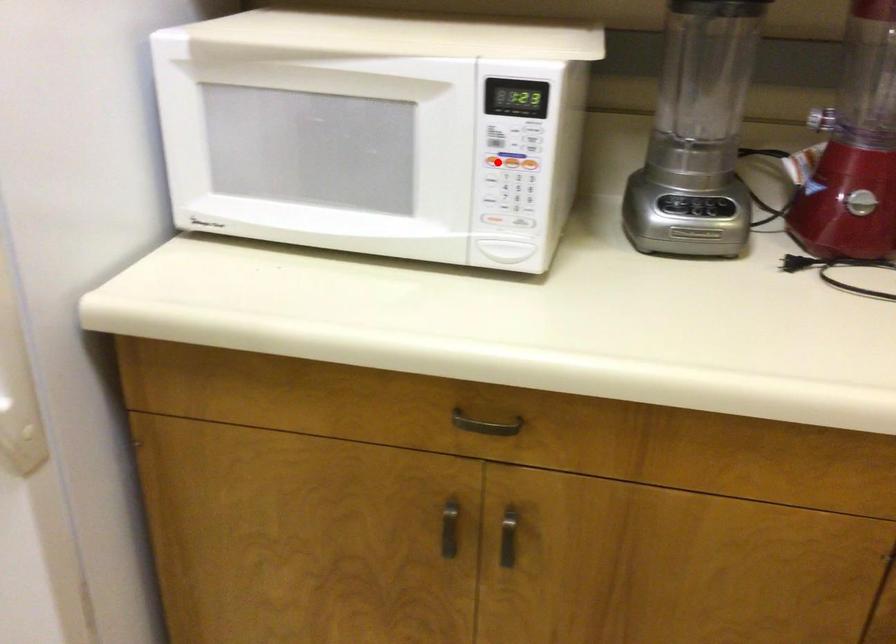
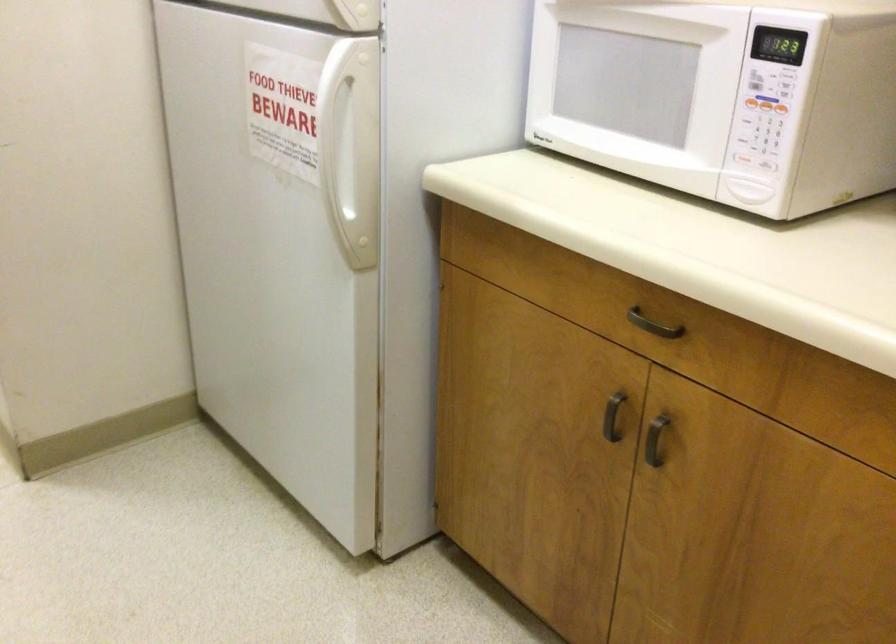
Where in the second image is the point corresponding to the highlighted location from the first image?

(752, 102)